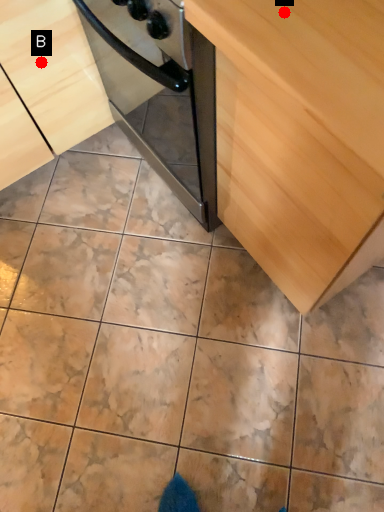
Question: Two points are circled on the image, labeled by A and B beside each circle. Which point appears closest to the camera in this image?

Choices:
 (A) A is closer
 (B) B is closer

Answer: (A)